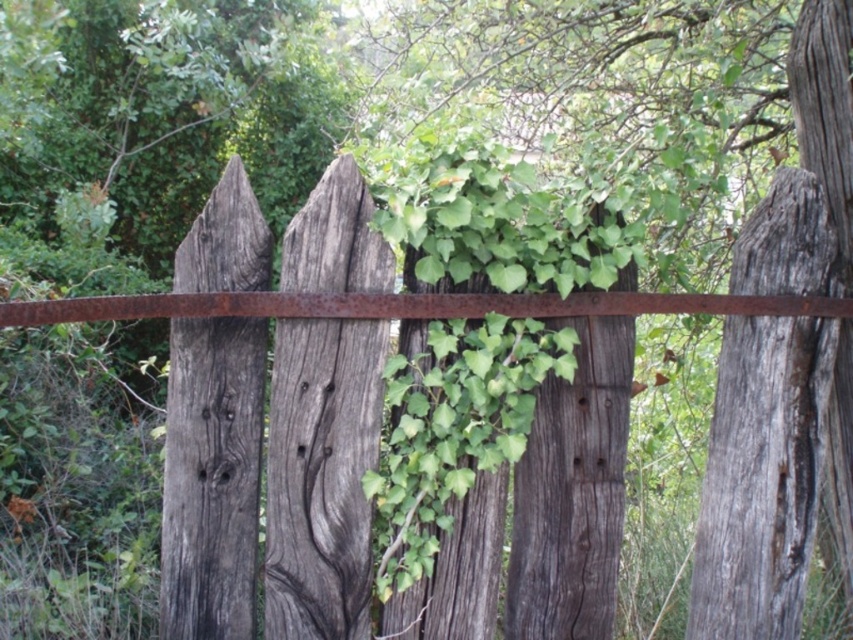
You are an artist sketching this scene and need to place the gray weathered wood at center and the weathered gray wood at left in your drawing. Which one should you draw first if you want to follow the left to right order?

The weathered gray wood at left should be drawn first since it is positioned to the left of the gray weathered wood at center.

You are a painter assessing the rustic wooden fence. You notice the gray weathered wood at center and the weathered gray wood at left. Which section of the fence requires more paint due to its greater width?

The gray weathered wood at center requires more paint because its width surpasses that of the weathered gray wood at left, meaning it has a larger surface area to cover.